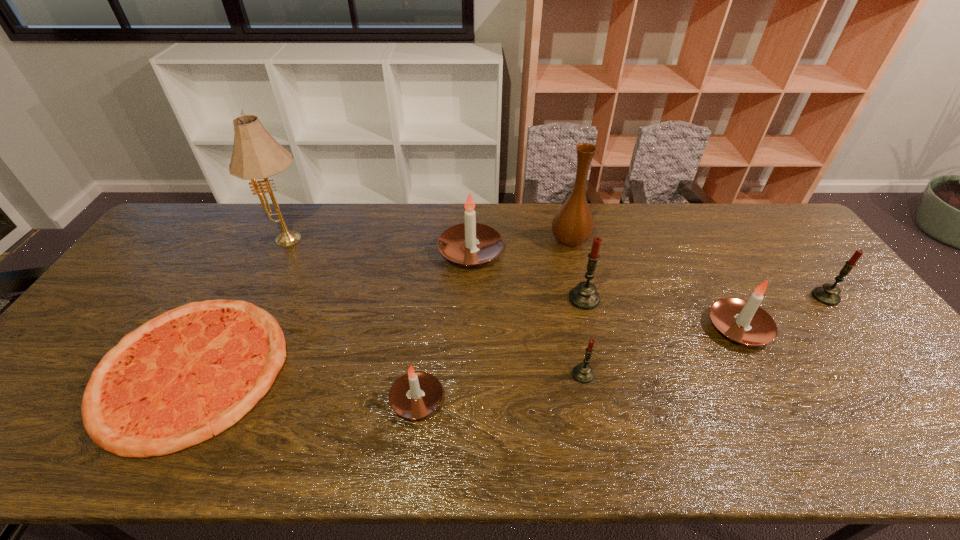
This screenshot has height=540, width=960. Find the location of `the second farthest white candle`. the second farthest white candle is located at coordinates (742, 321).

Locate an element on the screen. Image resolution: width=960 pixels, height=540 pixels. the smallest red candle is located at coordinates (583, 373).

At what (x,y) coordinates should I click in order to perform the action: click on the nearest white candle. Please return your answer as a coordinate pair (x, y). Looking at the image, I should click on (414, 395).

Identify the location of the shortest object. (185, 376).

Where is `pizza`? This screenshot has width=960, height=540. pizza is located at coordinates (185, 376).

What are the coordinates of `blank space located 0.290m on the left of the lampshade` in the screenshot? It's located at (176, 241).

The width and height of the screenshot is (960, 540). I want to click on free space located 0.300m on the left of the vase, so click(x=459, y=241).

Where is `free location located 0.260m on the left of the biggest red candle`? The width and height of the screenshot is (960, 540). free location located 0.260m on the left of the biggest red candle is located at coordinates (478, 299).

The height and width of the screenshot is (540, 960). I want to click on free region located 0.200m on the front of the farthest candle, so click(x=468, y=325).

This screenshot has height=540, width=960. Identify the location of blank space located on the left of the second biggest red candle. (720, 297).